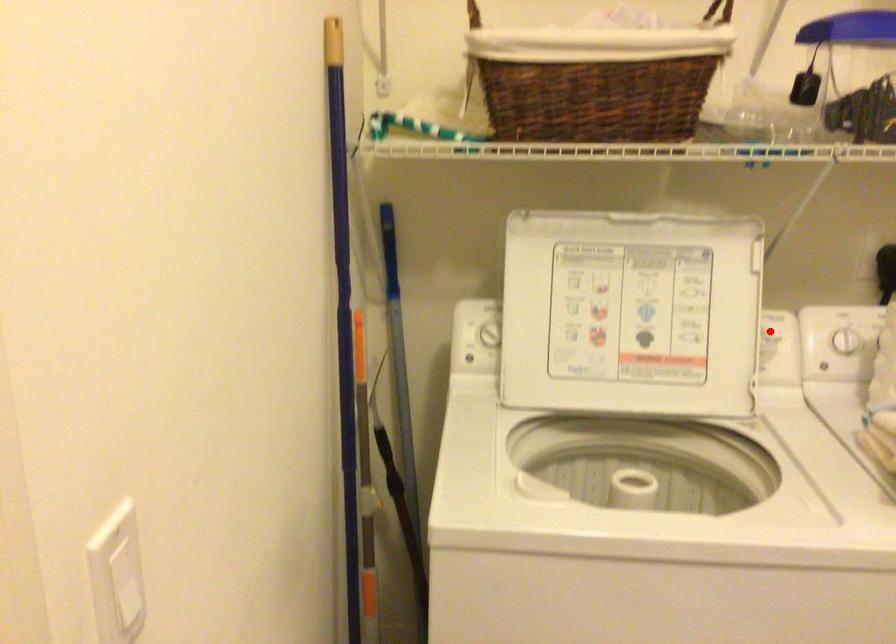
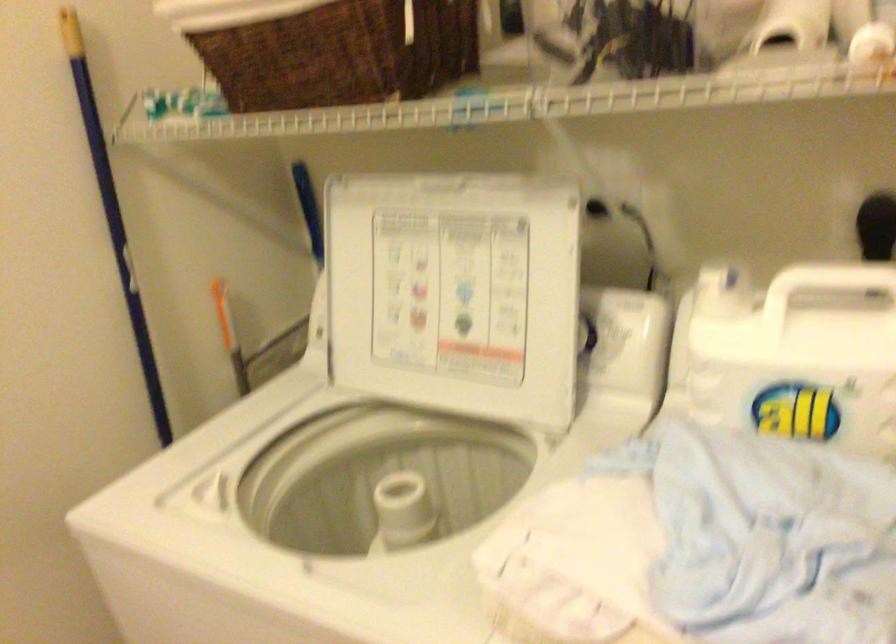
Question: I am providing you with two images of the same scene from different viewpoints. Image1 has a red point marked. In image2, the corresponding 3D location appears at what relative position? Reply with the corresponding letter.

Choices:
 (A) Closer
 (B) Farther

Answer: (A)